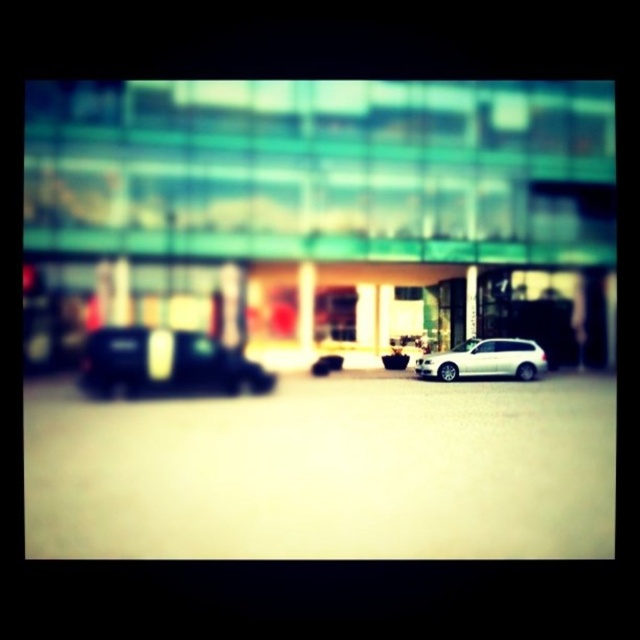
You are a delivery person trying to park your van between the shiny black car at left and the white matte suv at center. Can you fit your van, which is 5 meters long, in the space between them?

The shiny black car at left is bigger than the white matte suv at center, but the exact distance between them isn

You are a delivery person trying to park your van between the shiny black car at left and the white matte suv at center. Your van is 2 meters wide. Can you fit your van between them?

The shiny black car at left is wider than the white matte suv at center. However, the exact distance between them isn not provided. Without knowing the space between the two cars, it is impossible to determine if the van can fit.